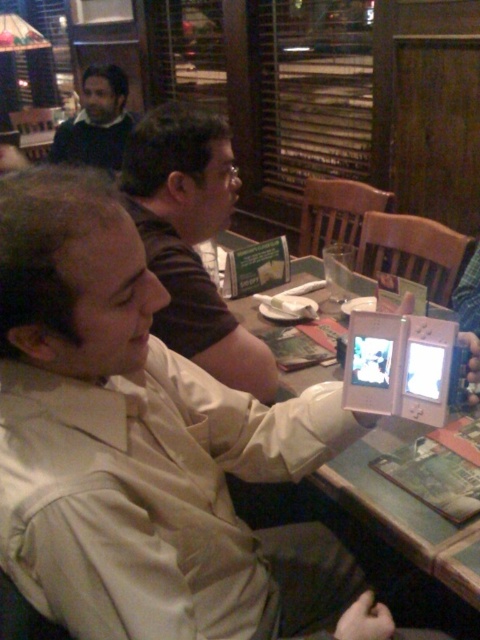
You are standing at the entrance of the restaurant and want to sit at the wooden table at center. Which direction should you walk to reach it?

Since the wooden table at center is located at coordinates approximately 0.839 on the x and 0.769 on the y axis, you should walk towards the center of the image to reach it.

You are sitting at the table in the image and want to reach both the point at (x=128, y=113) and the point at (x=379, y=392). Which point can you reach without moving your chair?

The point at (x=128, y=113) can be reached without moving your chair because it is closer to you than the point at (x=379, y=392).